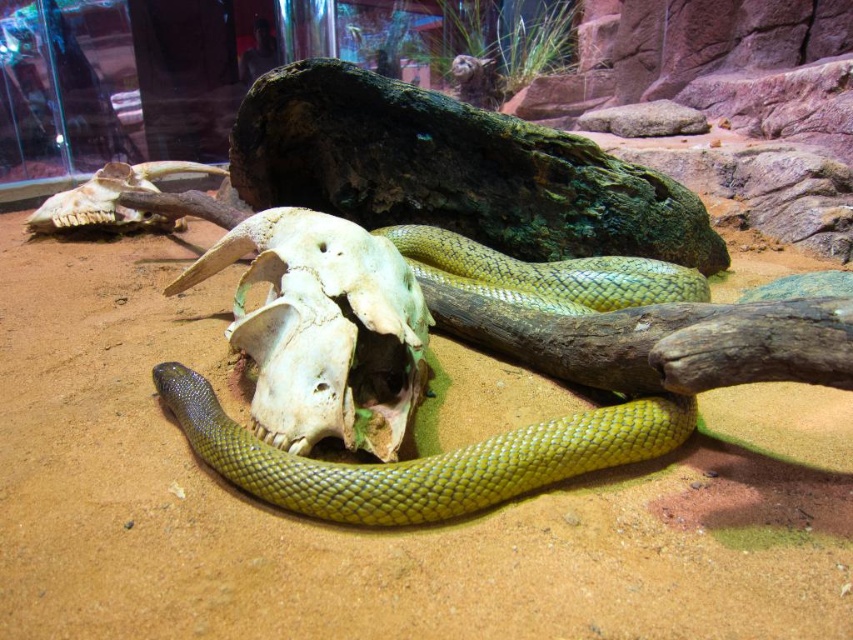
Where is `green glossy snake at center`? The height and width of the screenshot is (640, 853). green glossy snake at center is located at coordinates (421, 458).

Measure the distance between green glossy snake at center and white bone skull at center.

The distance of green glossy snake at center from white bone skull at center is 79.67 centimeters.

The width and height of the screenshot is (853, 640). I want to click on green glossy snake at center, so click(421, 458).